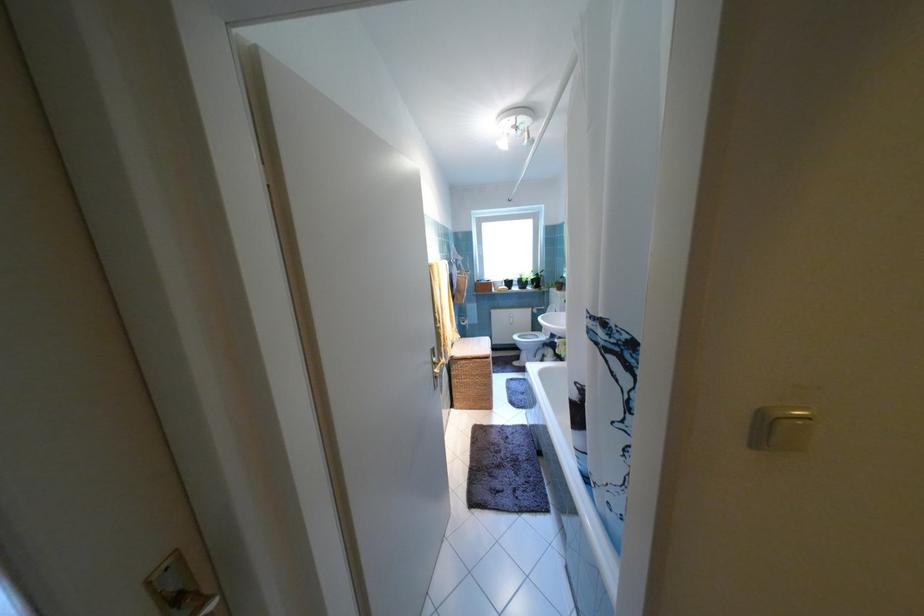
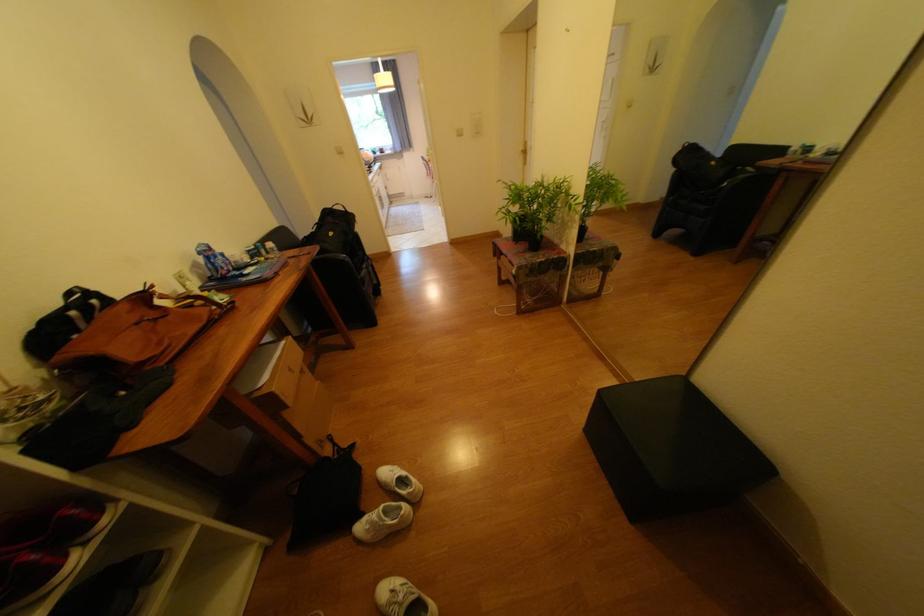
The images are taken continuously from a first-person perspective. In which direction are you moving?

The cameraman walked toward right, backward.